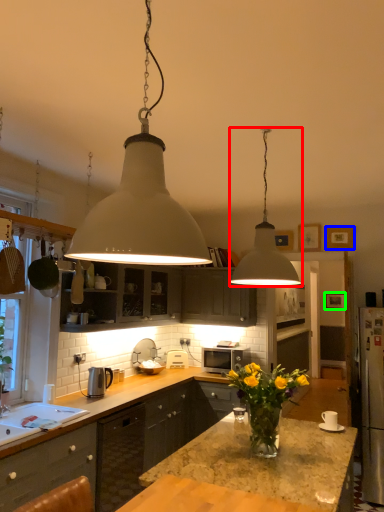
Question: Considering the real-world distances, which object is closest to lamp (highlighted by a red box)? picture frame (highlighted by a blue box) or picture frame (highlighted by a green box).

Choices:
 (A) picture frame
 (B) picture frame

Answer: (A)